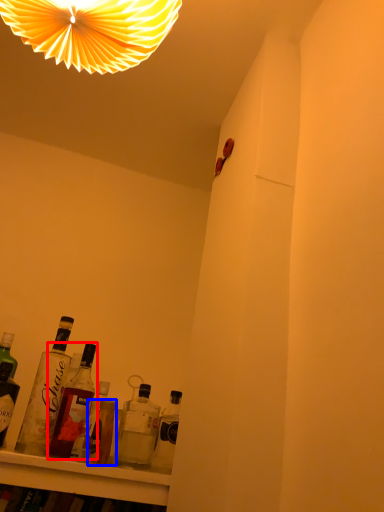
Question: Which object appears farthest to the camera in this image, bottle (highlighted by a red box) or bottle (highlighted by a blue box)?

Choices:
 (A) bottle
 (B) bottle

Answer: (A)